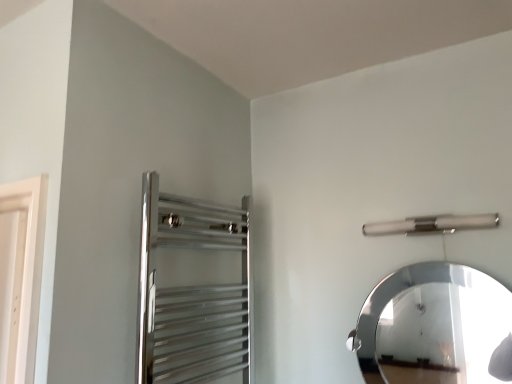
Question: Does polished chrome towel rack at upper left have a larger size compared to satin nickel towel bar at upper right?

Choices:
 (A) yes
 (B) no

Answer: (A)

Question: Can satin nickel towel bar at upper right be found inside polished chrome towel rack at upper left?

Choices:
 (A) yes
 (B) no

Answer: (B)

Question: Is polished chrome towel rack at upper left not near satin nickel towel bar at upper right?

Choices:
 (A) no
 (B) yes

Answer: (A)

Question: From the image's perspective, is polished chrome towel rack at upper left under satin nickel towel bar at upper right?

Choices:
 (A) yes
 (B) no

Answer: (A)

Question: Is polished chrome towel rack at upper left wider than satin nickel towel bar at upper right?

Choices:
 (A) no
 (B) yes

Answer: (B)

Question: Visually, is satin nickel towel bar at upper right positioned to the left or to the right of polished chrome towel rack at upper left?

Choices:
 (A) left
 (B) right

Answer: (B)

Question: Choose the correct answer: Is satin nickel towel bar at upper right inside polished chrome towel rack at upper left or outside it?

Choices:
 (A) inside
 (B) outside

Answer: (B)

Question: Is satin nickel towel bar at upper right in front of or behind polished chrome towel rack at upper left in the image?

Choices:
 (A) front
 (B) behind

Answer: (B)

Question: In terms of width, does satin nickel towel bar at upper right look wider or thinner when compared to polished chrome towel rack at upper left?

Choices:
 (A) thin
 (B) wide

Answer: (A)

Question: From a real-world perspective, is polished silver mirror at upper right positioned above or below satin nickel towel bar at upper right?

Choices:
 (A) above
 (B) below

Answer: (B)

Question: Do you think polished silver mirror at upper right is within satin nickel towel bar at upper right, or outside of it?

Choices:
 (A) inside
 (B) outside

Answer: (B)

Question: In the image, is polished silver mirror at upper right positioned in front of or behind satin nickel towel bar at upper right?

Choices:
 (A) front
 (B) behind

Answer: (A)

Question: Would you say polished silver mirror at upper right is to the left or to the right of satin nickel towel bar at upper right in the picture?

Choices:
 (A) right
 (B) left

Answer: (B)

Question: Is polished silver mirror at upper right in front of or behind polished chrome towel rack at upper left in the image?

Choices:
 (A) front
 (B) behind

Answer: (B)

Question: Does point (501, 307) appear closer or farther from the camera than point (222, 268)?

Choices:
 (A) farther
 (B) closer

Answer: (B)